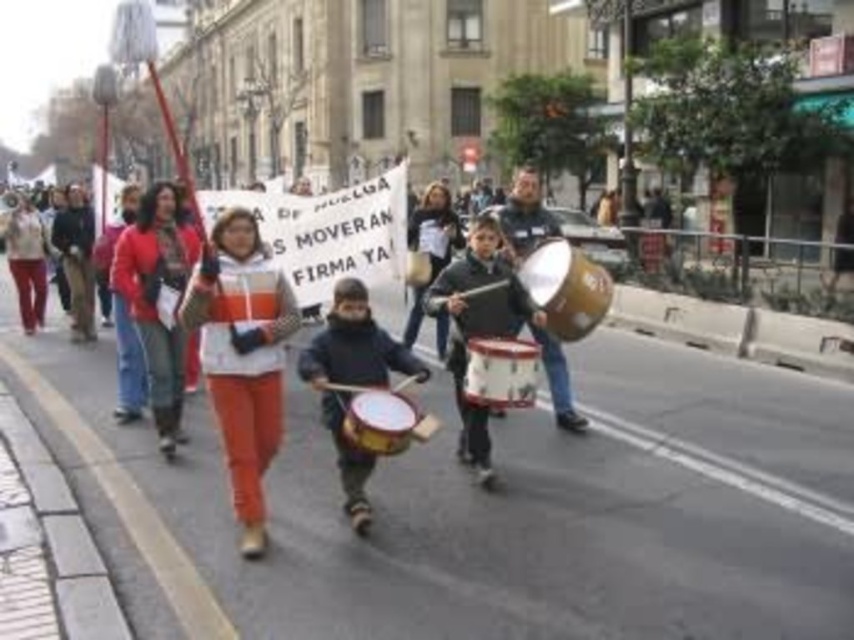
You are a photographer standing at the edge of the protest. You notice a specific point at coordinates point (156,300). Which object in the scene does this point correspond to?

The point (156,300) corresponds to the matte red jacket at center.

You are a photographer standing in the middle of the street. You see the matte black drum at center and the matte brown drum at center. Which drum is positioned closer to you?

The matte black drum at center is closer to the viewer than the matte brown drum at center.